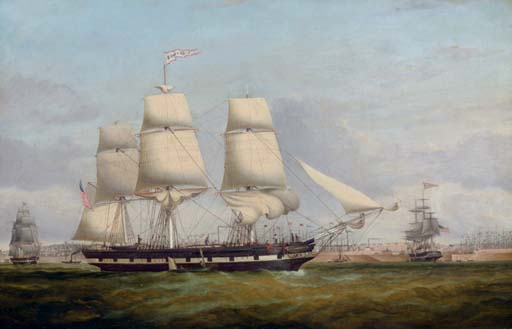
The image size is (512, 329). Identify the location of windows. (99, 259), (115, 259), (130, 260), (147, 259), (165, 259), (187, 259), (209, 261), (230, 259), (252, 259), (279, 256).